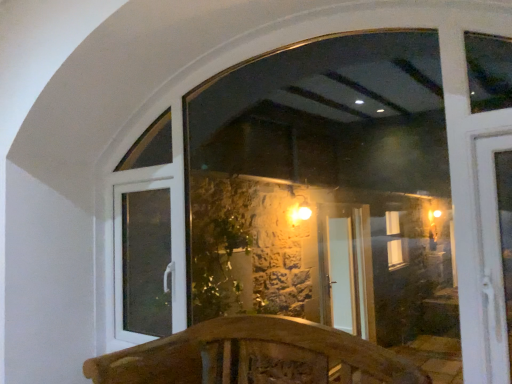
Question: From their relative heights in the image, would you say transparent glass window at center is taller or shorter than wooden carved bench at center?

Choices:
 (A) tall
 (B) short

Answer: (A)

Question: Considering the relative positions of transparent glass window at center and wooden carved bench at center in the image provided, is transparent glass window at center to the left or to the right of wooden carved bench at center?

Choices:
 (A) right
 (B) left

Answer: (A)

Question: Estimate the real-world distances between objects in this image. Which object is closer to the transparent glass window at center?

Choices:
 (A) wooden carved bench at center
 (B) white plastic door at lower left

Answer: (B)

Question: Estimate the real-world distances between objects in this image. Which object is closer to the white plastic door at lower left?

Choices:
 (A) wooden carved bench at center
 (B) transparent glass window at center

Answer: (A)